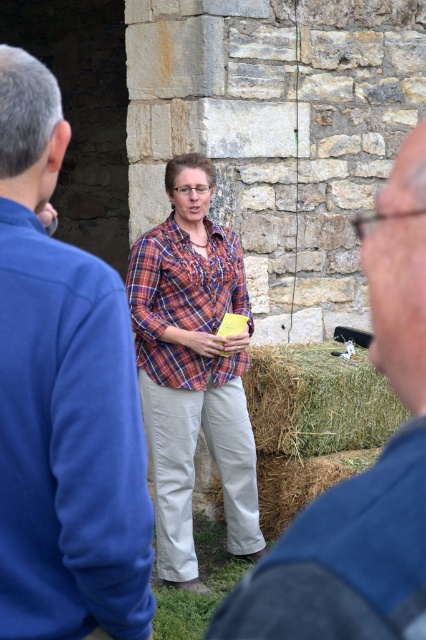
Where is the blue fabric shirt at center located in the image?

The blue fabric shirt at center is located at point (365, 472).

You are a person who is 1.7 meters tall and standing at the viewer position. You want to pick up the blue fleece jacket at center. Is the jacket within your reach without moving your feet?

The blue fleece jacket at center and viewer are 2.74 meters apart from each other. Since the viewer is 1.7 meters tall, they cannot reach the jacket without moving their feet because the distance is greater than their height.

You are a photographer trying to capture the woman in the scene. Where should you focus your camera to ensure the blue fabric shirt at center is in the frame?

You should focus your camera at point (365, 472) to ensure the blue fabric shirt at center is in the frame.